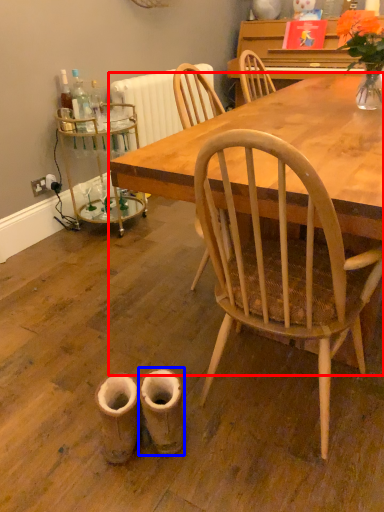
Question: Which point is closer to the camera, desk (highlighted by a red box) or walking shoe (highlighted by a blue box)?

Choices:
 (A) desk
 (B) walking shoe

Answer: (A)